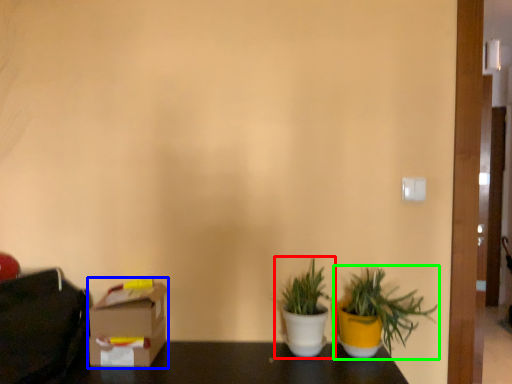
Question: Which object is the farthest from houseplant (highlighted by a red box)? Choose among these: cardboard box (highlighted by a blue box) or houseplant (highlighted by a green box).

Choices:
 (A) cardboard box
 (B) houseplant

Answer: (A)